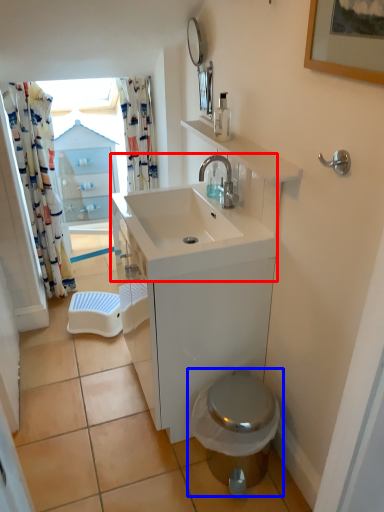
Question: Among these objects, which one is nearest to the camera, sink (highlighted by a red box) or toilet (highlighted by a blue box)?

Choices:
 (A) sink
 (B) toilet

Answer: (A)